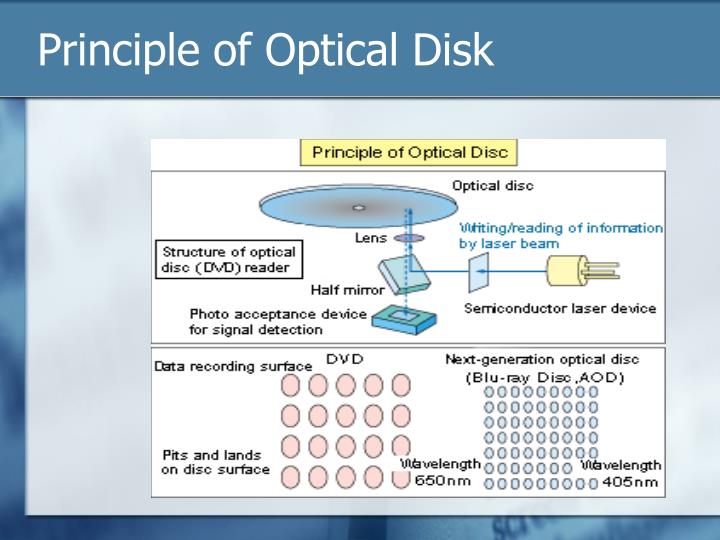
Find the location of a particular element. half mirror is located at coordinates (360, 287).